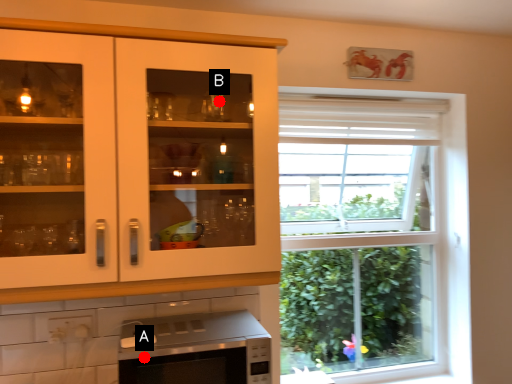
Question: Two points are circled on the image, labeled by A and B beside each circle. Which of the following is the closest to the observer?

Choices:
 (A) A is closer
 (B) B is closer

Answer: (A)